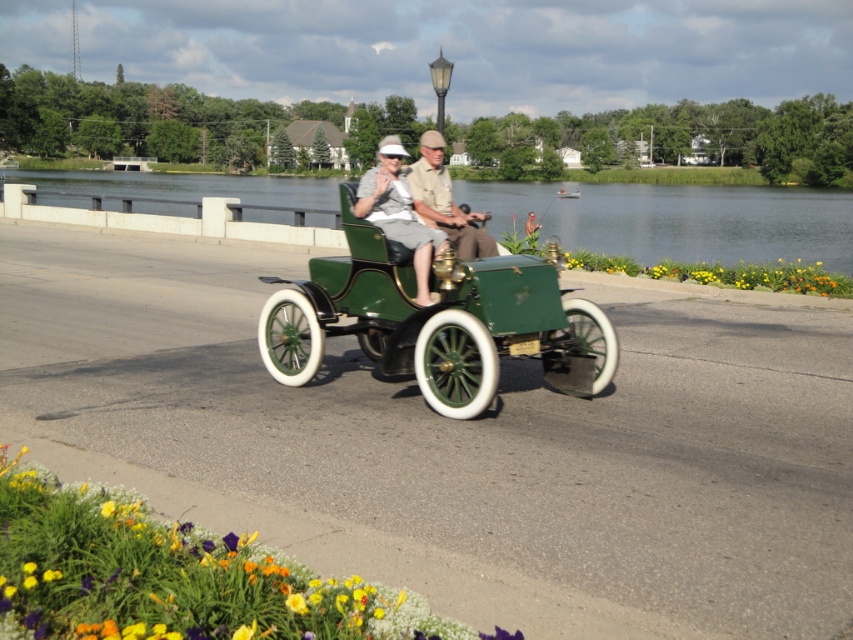
Is green matte sidecar at center taller than green matte water at center?

No.

Looking at this image, can you confirm if green matte sidecar at center is shorter than green matte water at center?

Yes, green matte sidecar at center is shorter than green matte water at center.

Locate an element on the screen. This screenshot has width=853, height=640. green matte sidecar at center is located at coordinates (437, 321).

The height and width of the screenshot is (640, 853). Describe the element at coordinates (172, 577) in the screenshot. I see `vibrant yellow petals at lower left` at that location.

Can you confirm if vibrant yellow petals at lower left is positioned to the right of yellow matte flower at right?

In fact, vibrant yellow petals at lower left is to the left of yellow matte flower at right.

Is point (376, 632) less distant than point (815, 288)?

That is True.

I want to click on vibrant yellow petals at lower left, so click(172, 577).

The height and width of the screenshot is (640, 853). What do you see at coordinates (677, 220) in the screenshot?
I see `green matte water at center` at bounding box center [677, 220].

Does green matte water at center have a greater width compared to yellow matte flower at right?

Correct, the width of green matte water at center exceeds that of yellow matte flower at right.

I want to click on green matte water at center, so click(677, 220).

The image size is (853, 640). What are the coordinates of `green matte water at center` in the screenshot? It's located at (677, 220).